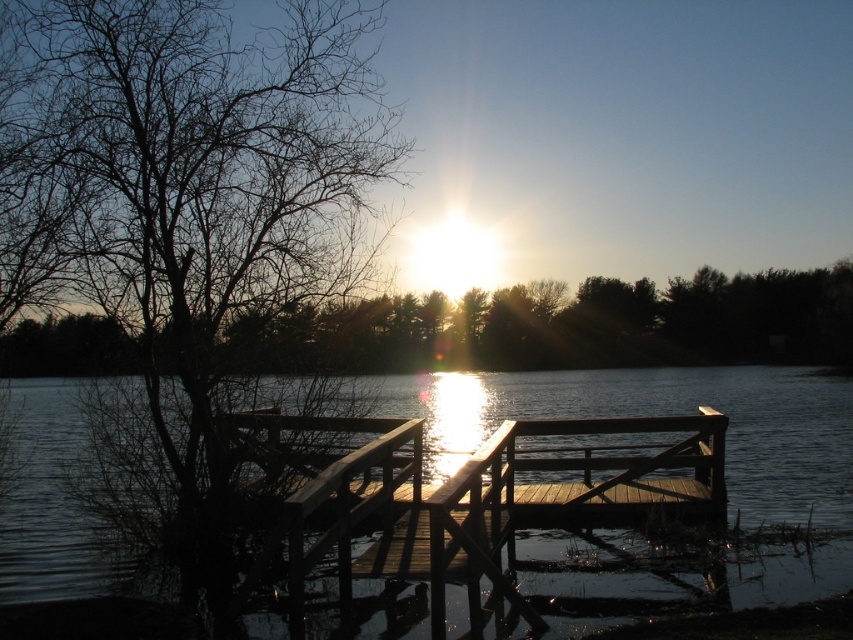
Can you confirm if bare branches at left is smaller than dark reflective water at center?

Indeed, bare branches at left has a smaller size compared to dark reflective water at center.

You are a GUI agent. You are given a task and a screenshot of the screen. Output one action in this format:
    pyautogui.click(x=<x>, y=<y>)
    Task: Click on the bare branches at left
    This screenshot has height=640, width=853.
    Given the screenshot: What is the action you would take?
    pyautogui.click(x=199, y=188)

Who is higher up, dark reflective water at center or brown wood tree at upper left?

brown wood tree at upper left

Which is more to the right, dark reflective water at center or brown wood tree at upper left?

brown wood tree at upper left

The image size is (853, 640). What are the coordinates of `dark reflective water at center` in the screenshot? It's located at (669, 412).

Does bare branches at left have a greater height compared to brown wood tree at upper left?

In fact, bare branches at left may be shorter than brown wood tree at upper left.

Is point (216, 433) more distant than point (251, 340)?

No, it is in front of (251, 340).

Measure the distance between bare branches at left and camera.

bare branches at left is 8.56 meters from camera.

Where is `bare branches at left`? The image size is (853, 640). bare branches at left is located at coordinates (199, 188).